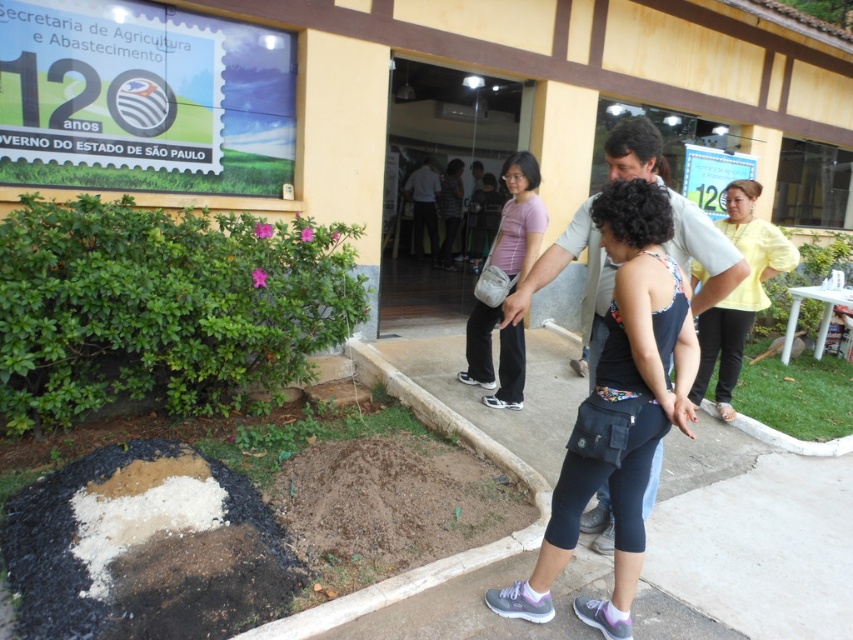
Between gray concrete pavement at center and purple fabric bag at center, which one is positioned higher?

purple fabric bag at center is higher up.

Does gray concrete pavement at center come behind purple fabric bag at center?

No.

Which is in front, point (537, 436) or point (498, 388)?

Point (537, 436)

Locate an element on the screen. This screenshot has height=640, width=853. gray concrete pavement at center is located at coordinates (753, 534).

Does gray concrete pavement at center appear on the left side of yellow matte shirt at right?

Yes, gray concrete pavement at center is to the left of yellow matte shirt at right.

Who is more forward, [544,449] or [746,280]?

Point [544,449] is in front.

The height and width of the screenshot is (640, 853). Describe the element at coordinates (753, 534) in the screenshot. I see `gray concrete pavement at center` at that location.

At what (x,y) coordinates should I click in order to perform the action: click on gray concrete pavement at center. Please return your answer as a coordinate pair (x, y). The height and width of the screenshot is (640, 853). Looking at the image, I should click on (753, 534).

Is point (844, 563) farther from viewer compared to point (648, 296)?

That is True.

Is point (550, 346) positioned in front of point (581, 444)?

No, it is behind (581, 444).

The width and height of the screenshot is (853, 640). I want to click on gray concrete pavement at center, so click(x=753, y=534).